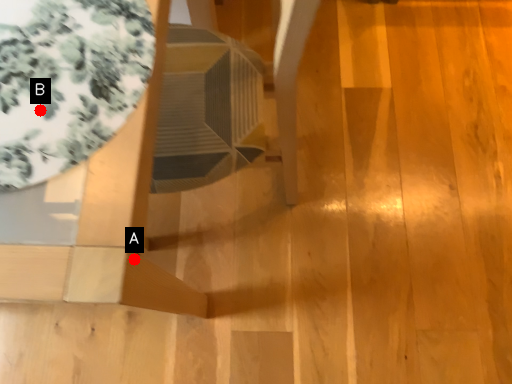
Question: Two points are circled on the image, labeled by A and B beside each circle. Which point is closer to the camera?

Choices:
 (A) A is closer
 (B) B is closer

Answer: (B)